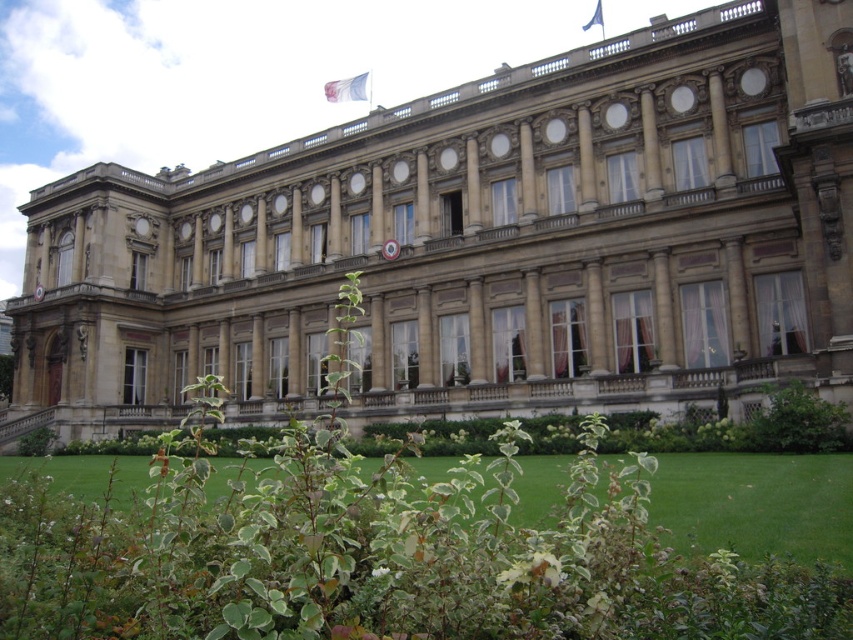
Question: Which of these objects is positioned farthest from the beige stone building at center?

Choices:
 (A) green grass at lower center
 (B) green leafy bush at lower right
 (C) green leafy bush at lower left

Answer: (B)

Question: Does beige stone building at center have a larger size compared to green leafy bush at lower right?

Choices:
 (A) no
 (B) yes

Answer: (B)

Question: Which of the following is the closest to the observer?

Choices:
 (A) (299, 275)
 (B) (775, 424)

Answer: (B)

Question: Is beige stone building at center smaller than green grass at lower center?

Choices:
 (A) yes
 (B) no

Answer: (B)

Question: Which is nearer to the beige stone building at center?

Choices:
 (A) green leafy bush at lower right
 (B) green leafy bush at lower left

Answer: (B)

Question: Can you confirm if beige stone building at center is positioned to the left of green grass at lower center?

Choices:
 (A) yes
 (B) no

Answer: (A)